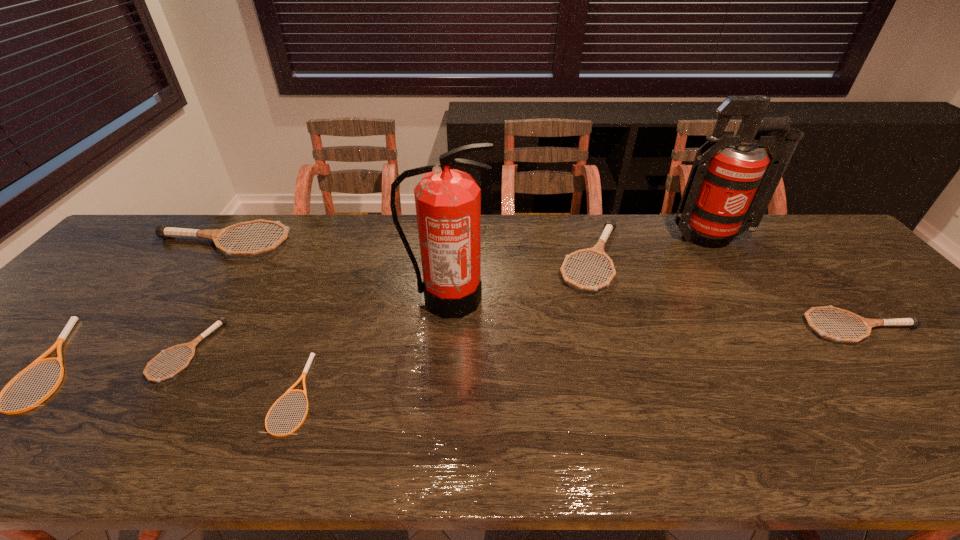
Identify which gray tennis racket is located as the third nearest to the rightmost gray tennis racket. Please provide its 2D coordinates. Your answer should be formatted as a tuple, i.e. [(x, y)], where the tuple contains the x and y coordinates of a point satisfying the conditions above.

[(191, 345)]

You are a GUI agent. You are given a task and a screenshot of the screen. Output one action in this format:
    pyautogui.click(x=<x>, y=<y>)
    Task: Click on the free location that satisfies the following two spatial constraints: 1. on the back side of the fourth tennis racket from left to right; 2. on the left side of the sixth object from left to right
    This screenshot has width=960, height=540.
    Given the screenshot: What is the action you would take?
    pyautogui.click(x=346, y=259)

Find the location of a particular element. Image resolution: width=960 pixels, height=540 pixels. vacant space that satisfies the following two spatial constraints: 1. on the front label side of the rightmost tennis racket; 2. on the left side of the red fire extinguisher is located at coordinates (772, 328).